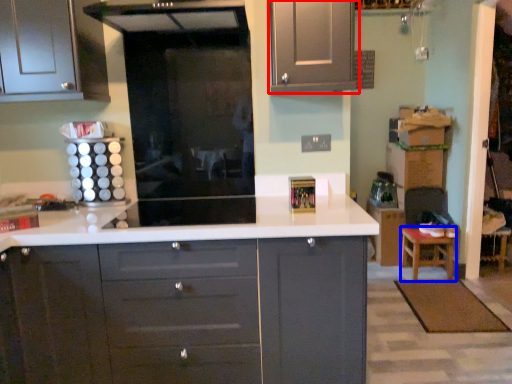
Question: Which object is closer to the camera taking this photo, cabinetry (highlighted by a red box) or stool (highlighted by a blue box)?

Choices:
 (A) cabinetry
 (B) stool

Answer: (A)